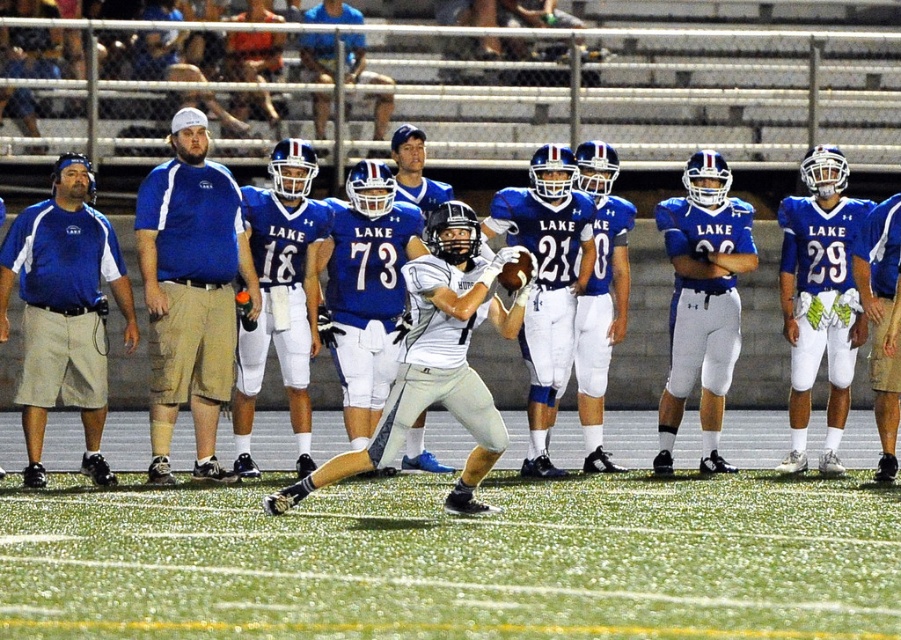
Looking at this image, you are a sports analyst reviewing the game footage. You notice the white matte jersey at center and the matte blue helmet at upper center in the frame. Based on their sizes in the image, which object would you estimate to be physically larger in real life?

The white matte jersey at center is larger in real life than the matte blue helmet at upper center because its width in the image is greater.